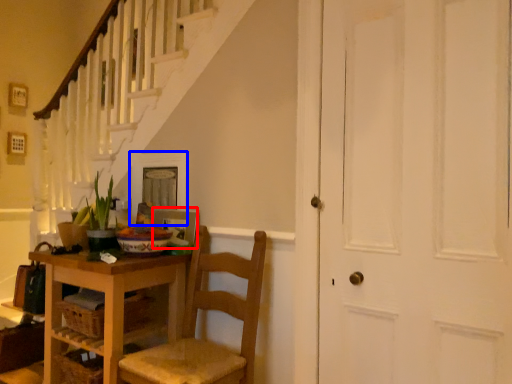
Question: Which object is further to the camera taking this photo, picture frame (highlighted by a red box) or picture frame (highlighted by a blue box)?

Choices:
 (A) picture frame
 (B) picture frame

Answer: (B)